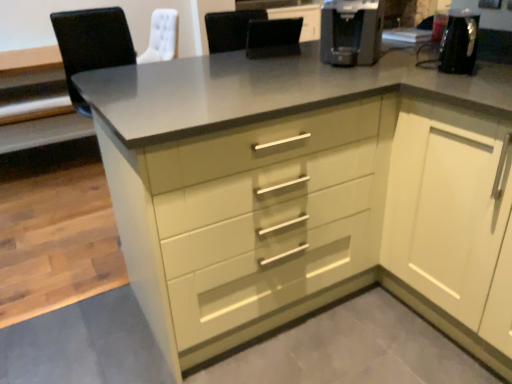
Question: Is point (258, 48) positioned closer to the camera than point (370, 56)?

Choices:
 (A) farther
 (B) closer

Answer: (A)

Question: Is black leather chair at center in front of or behind black plastic coffee machine at upper right in the image?

Choices:
 (A) behind
 (B) front

Answer: (A)

Question: Estimate the real-world distances between objects in this image. Which object is closer to the white glossy cabinet at right?

Choices:
 (A) black plastic coffee machine at upper right
 (B) black leather chair at center

Answer: (A)

Question: Estimate the real-world distances between objects in this image. Which object is closer to the white glossy cabinet at right?

Choices:
 (A) black plastic coffee machine at upper right
 (B) black leather chair at center

Answer: (A)